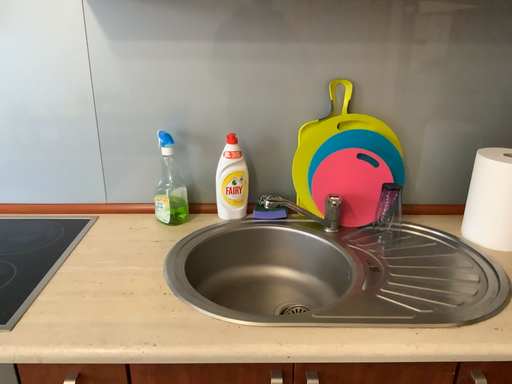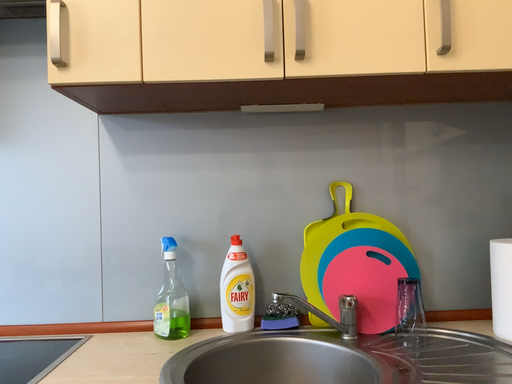
Question: Which way did the camera rotate in the video?

Choices:
 (A) rotated upward
 (B) rotated downward

Answer: (A)